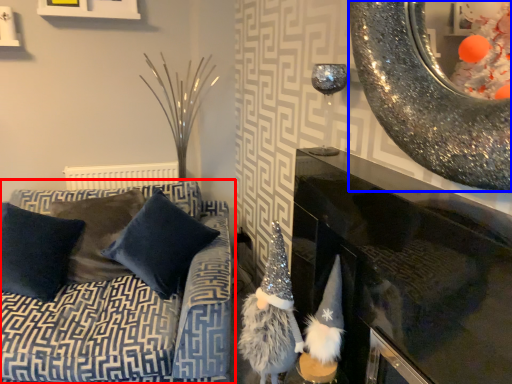
Question: Which object is closer to the camera taking this photo, studio couch (highlighted by a red box) or oval (highlighted by a blue box)?

Choices:
 (A) studio couch
 (B) oval

Answer: (B)